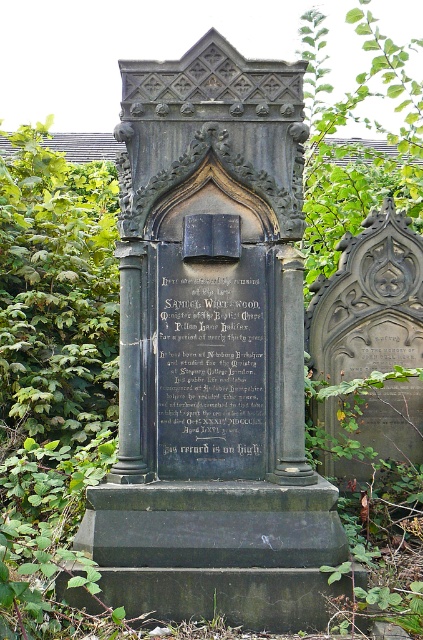
Based on the photo, you are standing at the camera position and want to place a 10 feet long decorative banner in front of the dark gray stone monument at center. Can you determine if the banner will fit in front of the monument without overlapping it?

The dark gray stone monument at center is 12.54 feet away from the camera. Since the banner is 10 feet long, it can be placed in front of the monument without overlapping it as there is enough space between the camera and the monument.